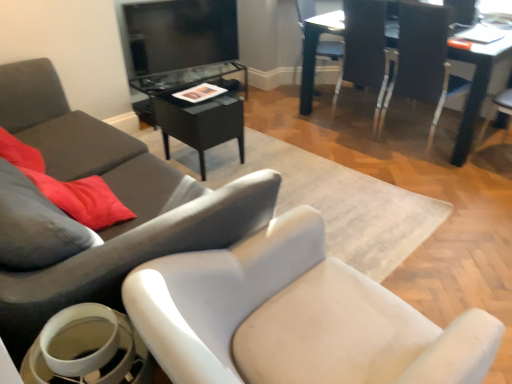
Question: Considering the relative sizes of white plastic chair at upper right, marked as the 1th chair in a right-to-left arrangement, and white plastic chair at upper right, the 3th chair from the left, in the image provided, is white plastic chair at upper right, marked as the 1th chair in a right-to-left arrangement, bigger than white plastic chair at upper right, the 3th chair from the left,?

Choices:
 (A) no
 (B) yes

Answer: (B)

Question: Considering the relative positions of white plastic chair at upper right, marked as the 1th chair in a right-to-left arrangement, and white plastic chair at upper right, the 3th chair from the left, in the image provided, is white plastic chair at upper right, marked as the 1th chair in a right-to-left arrangement, to the left of white plastic chair at upper right, the 3th chair from the left, from the viewer's perspective?

Choices:
 (A) yes
 (B) no

Answer: (B)

Question: Is white plastic chair at upper right, marked as the 1th chair in a right-to-left arrangement, wider than white plastic chair at upper right, the 3th chair from the left?

Choices:
 (A) yes
 (B) no

Answer: (A)

Question: From the image's perspective, is white plastic chair at upper right, marked as the 1th chair in a right-to-left arrangement, on top of white plastic chair at upper right, the 3th chair when ordered from right to left?

Choices:
 (A) yes
 (B) no

Answer: (B)

Question: Does white plastic chair at upper right, marked as the 5th chair in a left-to-right arrangement, touch white plastic chair at upper right, the 3th chair from the left?

Choices:
 (A) no
 (B) yes

Answer: (A)

Question: Based on their sizes in the image, would you say white glossy chair at upper right, marked as the 2th chair in a right-to-left arrangement, is bigger or smaller than white plastic chair at upper right, marked as the 5th chair in a left-to-right arrangement?

Choices:
 (A) small
 (B) big

Answer: (B)

Question: From the image's perspective, is white glossy chair at upper right, marked as the 2th chair in a right-to-left arrangement, positioned above or below white plastic chair at upper right, marked as the 1th chair in a right-to-left arrangement?

Choices:
 (A) above
 (B) below

Answer: (A)

Question: From a real-world perspective, is white glossy chair at upper right, the fourth chair viewed from the left, above or below white plastic chair at upper right, marked as the 1th chair in a right-to-left arrangement?

Choices:
 (A) above
 (B) below

Answer: (B)

Question: Is white glossy chair at upper right, marked as the 2th chair in a right-to-left arrangement, situated inside white plastic chair at upper right, marked as the 1th chair in a right-to-left arrangement, or outside?

Choices:
 (A) outside
 (B) inside

Answer: (A)

Question: From a real-world perspective, relative to white glossy cup at lower left, is white glossy chair at upper right, the fourth chair viewed from the left, vertically above or below?

Choices:
 (A) below
 (B) above

Answer: (B)

Question: Relative to white glossy cup at lower left, is white glossy chair at upper right, the fourth chair viewed from the left, in front or behind?

Choices:
 (A) front
 (B) behind

Answer: (B)

Question: Looking at the image, does white glossy chair at upper right, marked as the 2th chair in a right-to-left arrangement, seem bigger or smaller compared to white glossy cup at lower left?

Choices:
 (A) small
 (B) big

Answer: (B)

Question: Considering the positions of white glossy chair at upper right, marked as the 2th chair in a right-to-left arrangement, and white glossy cup at lower left in the image, is white glossy chair at upper right, marked as the 2th chair in a right-to-left arrangement, taller or shorter than white glossy cup at lower left?

Choices:
 (A) tall
 (B) short

Answer: (A)

Question: From the image's perspective, is black glass table at center, acting as the 2th table starting from the right, above or below white glossy cup at lower left?

Choices:
 (A) below
 (B) above

Answer: (B)

Question: Would you say black glass table at center, acting as the 2th table starting from the right, is to the left or to the right of white glossy cup at lower left in the picture?

Choices:
 (A) left
 (B) right

Answer: (B)